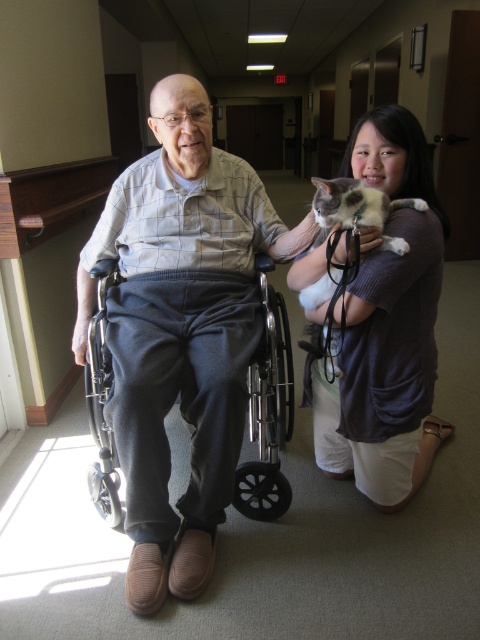
Question: Which object appears closest to the camera in this image?

Choices:
 (A) gray corduroy pants at center
 (B) soft fur cat at right
 (C) white cotton shirt at lower right

Answer: (B)

Question: Which point is closer to the camera?

Choices:
 (A) soft fur cat at right
 (B) white cotton shirt at lower right
 (C) gray corduroy pants at center

Answer: (A)

Question: Does gray corduroy pants at center have a greater width compared to metallic gray wheelchair at center?

Choices:
 (A) yes
 (B) no

Answer: (A)

Question: Does gray corduroy pants at center appear on the right side of metallic gray wheelchair at center?

Choices:
 (A) no
 (B) yes

Answer: (A)

Question: Does gray corduroy pants at center have a greater width compared to soft fur cat at right?

Choices:
 (A) no
 (B) yes

Answer: (B)

Question: Which point appears farthest from the camera in this image?

Choices:
 (A) (101, 314)
 (B) (153, 540)

Answer: (A)